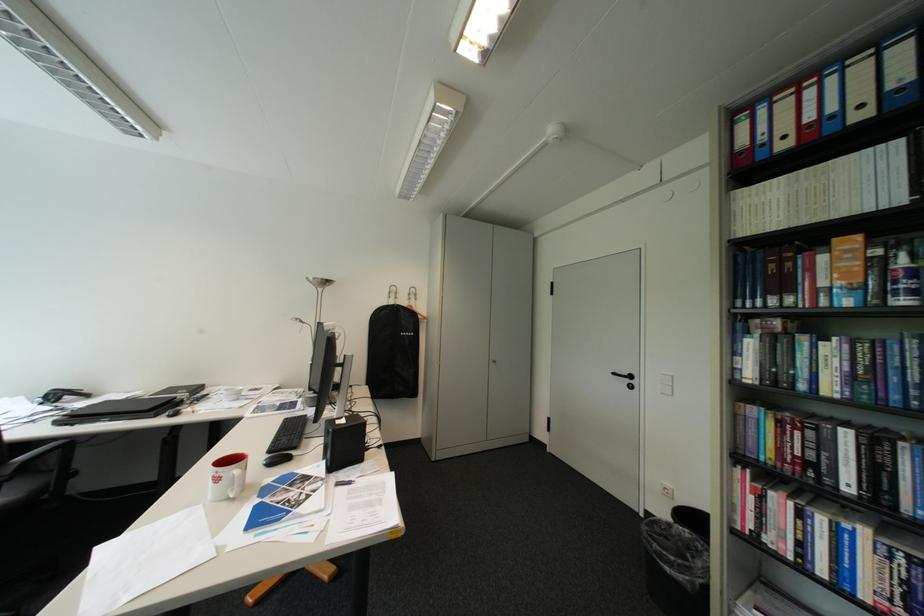
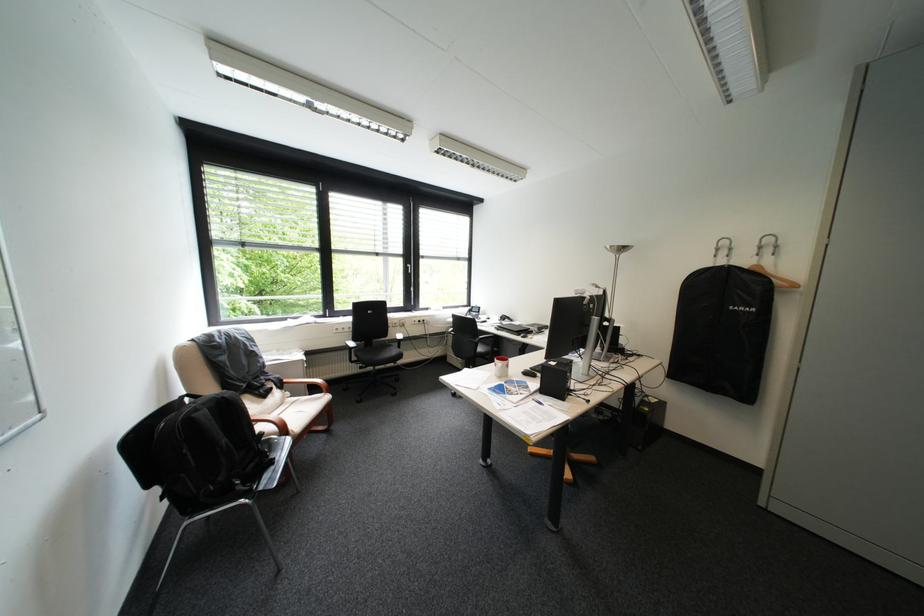
Locate, in the second image, the point that corresponds to point 418,307 in the first image.

(759, 268)